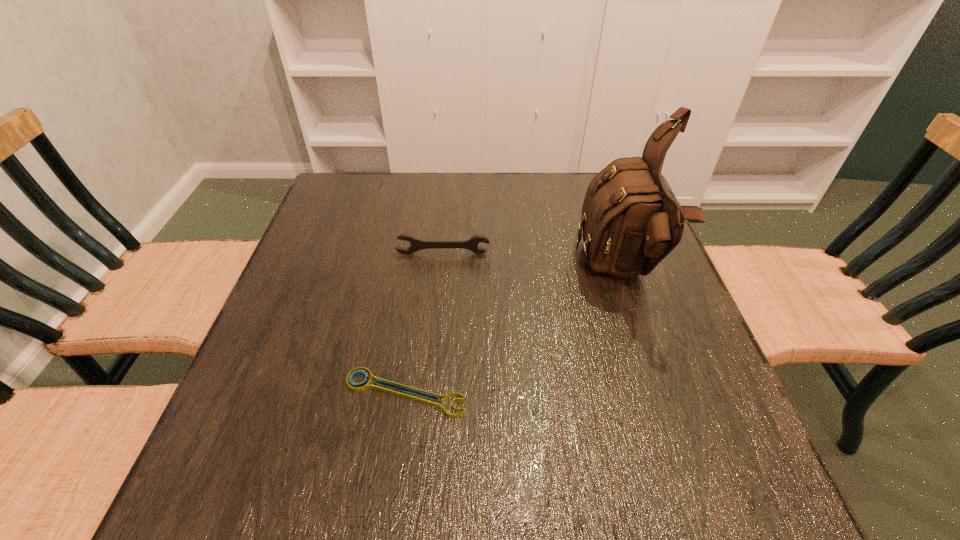
At what (x,y) coordinates should I click in order to perform the action: click on vacant space that is in between the farther wrench and the shoulder bag. Please return your answer as a coordinate pair (x, y). Looking at the image, I should click on (532, 263).

Locate an element on the screen. Image resolution: width=960 pixels, height=540 pixels. free space between the taller wrench and the rightmost object is located at coordinates (532, 263).

Locate an element on the screen. The image size is (960, 540). vacant space in between the nearer wrench and the taller wrench is located at coordinates (424, 323).

This screenshot has width=960, height=540. In order to click on free space between the second tallest object and the shortest object in this screenshot , I will do `click(424, 323)`.

Identify the location of free spot between the rightmost object and the taller wrench. (532, 263).

The image size is (960, 540). What are the coordinates of `free space between the shoulder bag and the nearer wrench` in the screenshot? It's located at pos(513,333).

Identify the location of unoccupied position between the shortest object and the tallest object. (513, 333).

In order to click on unoccupied area between the farther wrench and the shorter wrench in this screenshot , I will do `click(424, 323)`.

Locate an element on the screen. The width and height of the screenshot is (960, 540). free area in between the shoulder bag and the nearest object is located at coordinates (513, 333).

What are the coordinates of `object that is the second closest to the shoulder bag` in the screenshot? It's located at (361, 386).